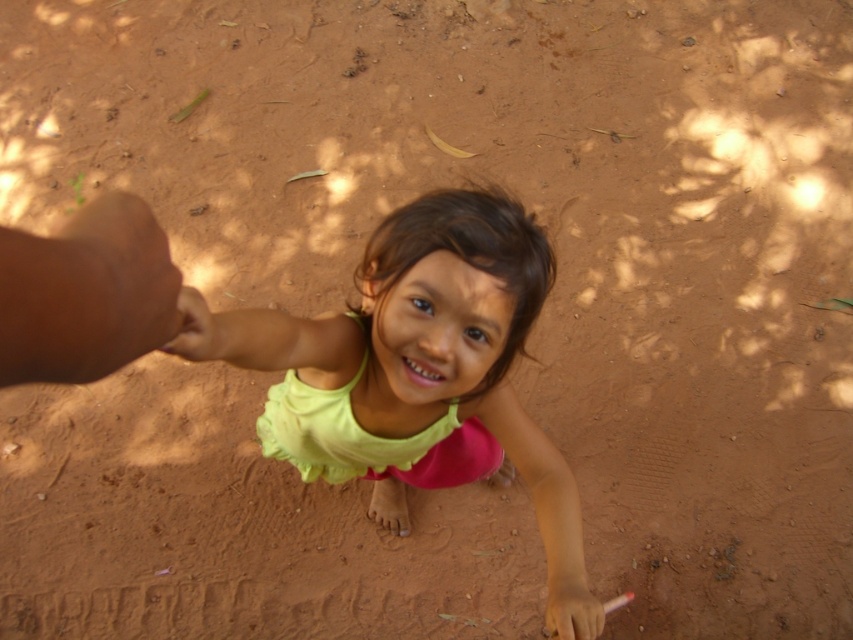
Is pink matte toothbrush at lower center positioned before light brown skin at lower left?

No, it is behind light brown skin at lower left.

Is pink matte toothbrush at lower center smaller than light brown skin at lower left?

Correct, pink matte toothbrush at lower center occupies less space than light brown skin at lower left.

Based on the photo, who is more forward, [550,624] or [193,346]?

Point [193,346] is more forward.

At what (x,y) coordinates should I click in order to perform the action: click on pink matte toothbrush at lower center. Please return your answer as a coordinate pair (x, y). This screenshot has width=853, height=640. Looking at the image, I should click on (572, 611).

Can you confirm if light green fabric dress at center is positioned to the right of light brown skin at lower left?

Indeed, light green fabric dress at center is positioned on the right side of light brown skin at lower left.

Does light green fabric dress at center have a greater height compared to light brown skin at lower left?

Correct, light green fabric dress at center is much taller as light brown skin at lower left.

Does point (427, 406) lie behind point (184, 342)?

Yes, point (427, 406) is farther from viewer.

Where is `light green fabric dress at center`? light green fabric dress at center is located at coordinates (421, 365).

Who is higher up, light green fabric dress at center or pink matte toothbrush at lower center?

light green fabric dress at center

Is point (456, 328) in front of point (555, 586)?

Yes, point (456, 328) is in front of point (555, 586).

Between point (387, 528) and point (579, 589), which one is positioned behind?

Point (387, 528)

This screenshot has height=640, width=853. Identify the location of light green fabric dress at center. (421, 365).